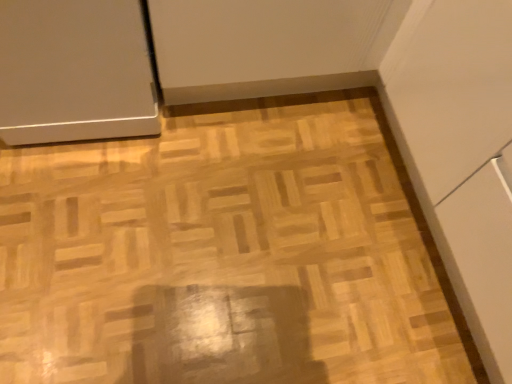
I want to click on satin white door at upper left, so click(x=74, y=71).

What do you see at coordinates (74, 71) in the screenshot? I see `satin white door at upper left` at bounding box center [74, 71].

What do you see at coordinates (226, 254) in the screenshot?
I see `natural wood parquet floor at center` at bounding box center [226, 254].

Image resolution: width=512 pixels, height=384 pixels. In order to click on natural wood parquet floor at center in this screenshot , I will do `click(226, 254)`.

You are a GUI agent. You are given a task and a screenshot of the screen. Output one action in this format:
    pyautogui.click(x=<x>, y=<y>)
    Task: Click on the satin white door at upper left
    This screenshot has height=384, width=512.
    Given the screenshot: What is the action you would take?
    pyautogui.click(x=74, y=71)

Which is more to the left, satin white door at upper left or natural wood parquet floor at center?

Positioned to the left is satin white door at upper left.

Is satin white door at upper left closer to camera compared to natural wood parquet floor at center?

Yes, satin white door at upper left is in front of natural wood parquet floor at center.

Considering the points (38, 110) and (138, 350), which point is in front, point (38, 110) or point (138, 350)?

The point (138, 350) is in front.

From the image's perspective, is satin white door at upper left above or below natural wood parquet floor at center?

From the image's perspective, satin white door at upper left appears above natural wood parquet floor at center.

From a real-world perspective, is satin white door at upper left located beneath natural wood parquet floor at center?

No, from a real-world perspective, satin white door at upper left is not under natural wood parquet floor at center.

Which of these two, satin white door at upper left or natural wood parquet floor at center, is wider?

natural wood parquet floor at center is wider.

From their relative heights in the image, would you say satin white door at upper left is taller or shorter than natural wood parquet floor at center?

Considering their sizes, satin white door at upper left has more height than natural wood parquet floor at center.

Who is bigger, satin white door at upper left or natural wood parquet floor at center?

Bigger between the two is satin white door at upper left.

Is natural wood parquet floor at center surrounded by satin white door at upper left?

Actually, natural wood parquet floor at center is outside satin white door at upper left.

Is the surface of satin white door at upper left in direct contact with natural wood parquet floor at center?

No.

Is satin white door at upper left facing away from natural wood parquet floor at center?

satin white door at upper left does not have its back to natural wood parquet floor at center.

What's the angular difference between satin white door at upper left and natural wood parquet floor at center's facing directions?

The facing directions of satin white door at upper left and natural wood parquet floor at center are 0.0967 degrees apart.

Identify the location of door on the left of natural wood parquet floor at center. The height and width of the screenshot is (384, 512). point(74,71).

Is natural wood parquet floor at center to the left of satin white door at upper left from the viewer's perspective?

In fact, natural wood parquet floor at center is to the right of satin white door at upper left.

Considering the positions of objects natural wood parquet floor at center and satin white door at upper left in the image provided, who is behind, natural wood parquet floor at center or satin white door at upper left?

natural wood parquet floor at center.

Which is closer, (188, 166) or (60, 27)?

Point (60, 27)

From the image's perspective, who appears lower, natural wood parquet floor at center or satin white door at upper left?

natural wood parquet floor at center is shown below in the image.

From a real-world perspective, between natural wood parquet floor at center and satin white door at upper left, who is vertically lower?

natural wood parquet floor at center.

Which object is thinner, natural wood parquet floor at center or satin white door at upper left?

satin white door at upper left is thinner.

In terms of height, does natural wood parquet floor at center look taller or shorter compared to satin white door at upper left?

Considering their sizes, natural wood parquet floor at center has less height than satin white door at upper left.

Between natural wood parquet floor at center and satin white door at upper left, which one has smaller size?

With smaller size is natural wood parquet floor at center.

Is natural wood parquet floor at center inside or outside of satin white door at upper left?

natural wood parquet floor at center exists outside the volume of satin white door at upper left.

Is natural wood parquet floor at center beside satin white door at upper left?

There is a gap between natural wood parquet floor at center and satin white door at upper left.

Could you tell me if natural wood parquet floor at center is facing satin white door at upper left?

No, natural wood parquet floor at center is not oriented towards satin white door at upper left.

Where is `door on the left side of natural wood parquet floor at center`? door on the left side of natural wood parquet floor at center is located at coordinates (74, 71).

Identify the location of door above the natural wood parquet floor at center (from the image's perspective). The image size is (512, 384). (74, 71).

At what (x,y) coordinates should I click in order to perform the action: click on plywood that is below the satin white door at upper left (from the image's perspective). Please return your answer as a coordinate pair (x, y). This screenshot has height=384, width=512. Looking at the image, I should click on (226, 254).